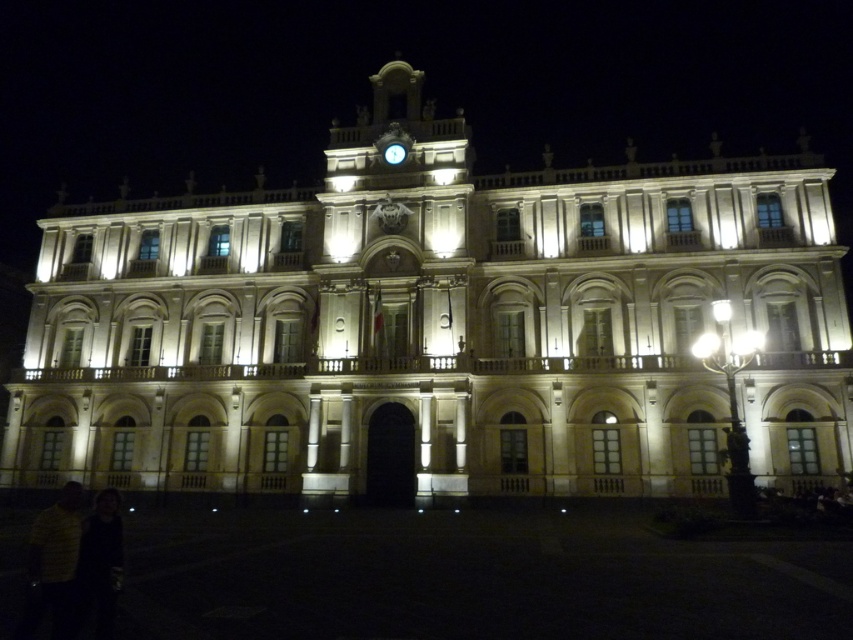
In the scene shown: You are a photographer standing in front of the beige stone building at center and the metallic clock at upper center. You want to capture a photo where both objects are visible in the frame. Which object should you position closer to the left side of the camera frame to ensure both are included?

The beige stone building at center is positioned on the left side of metallic clock at upper center, so to include both in the frame, you should position the beige stone building at center closer to the left side of the camera frame.